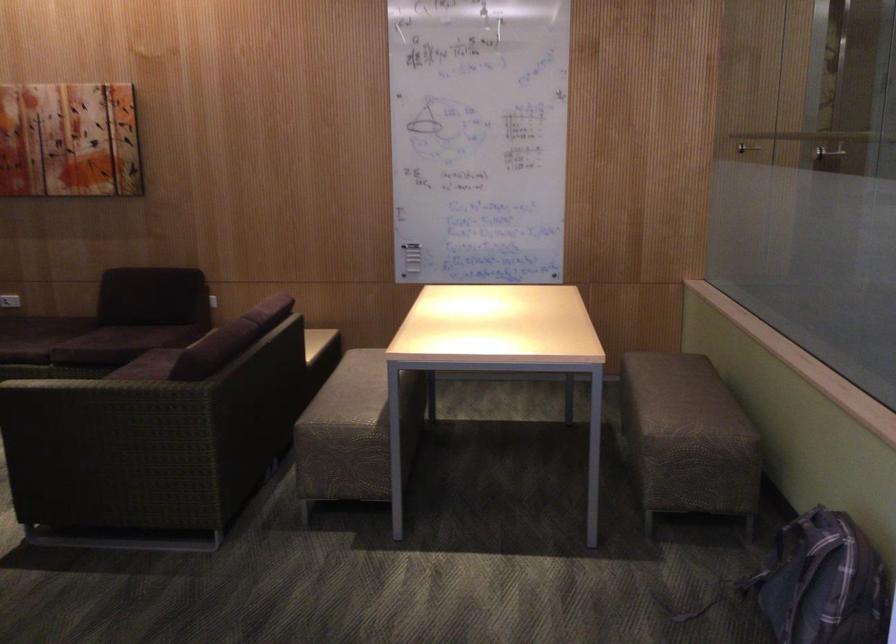
The image size is (896, 644). Identify the location of purple sofa sitting surface. (123, 322).